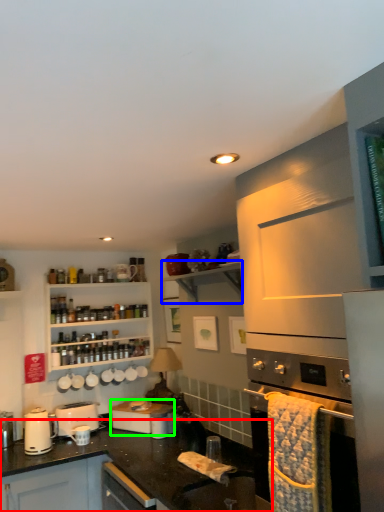
Question: Estimate the real-world distances between objects in this image. Which object is closer to countertop (highlighted by a red box), shelf (highlighted by a blue box) or appliance (highlighted by a green box)?

Choices:
 (A) shelf
 (B) appliance

Answer: (B)